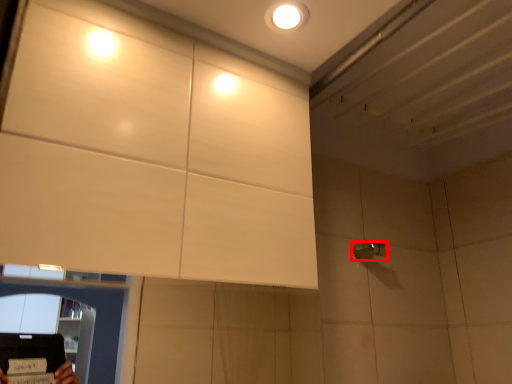
Question: Considering the relative positions of shower (annotated by the red box) and droplight in the image provided, where is shower (annotated by the red box) located with respect to the staircase?

Choices:
 (A) right
 (B) left

Answer: (A)